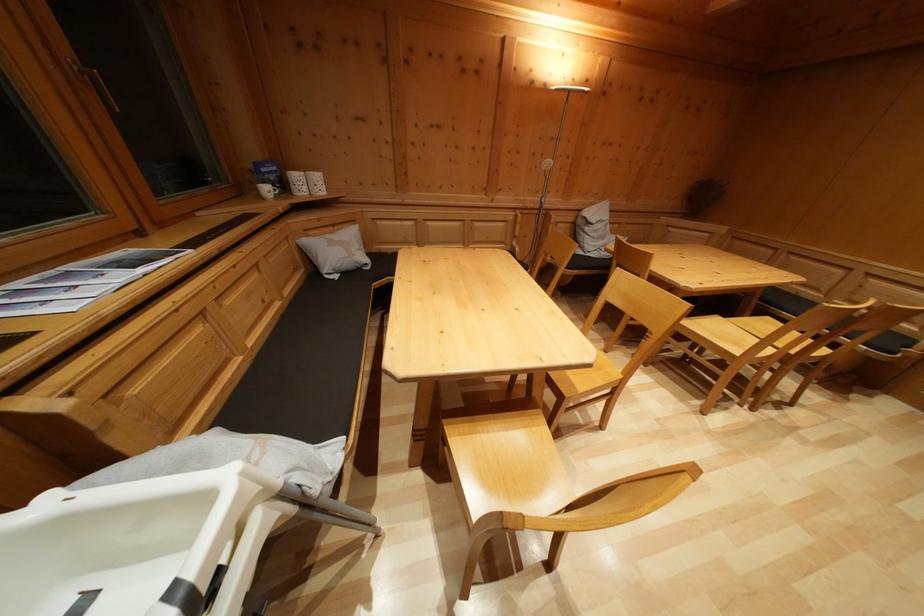
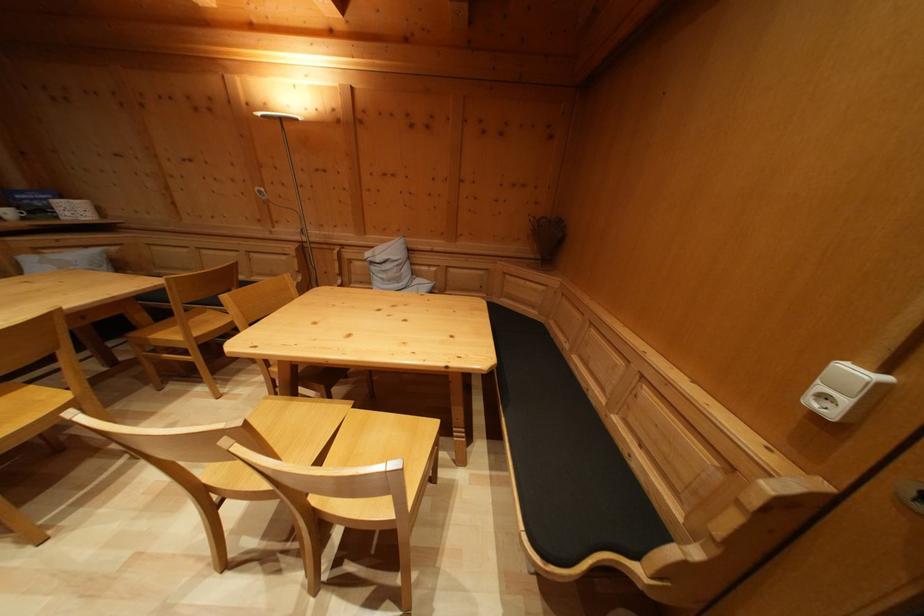
Question: What movement of the cameraman would produce the second image?

Choices:
 (A) Left
 (B) Right
 (C) Forward
 (D) Backward

Answer: (B)